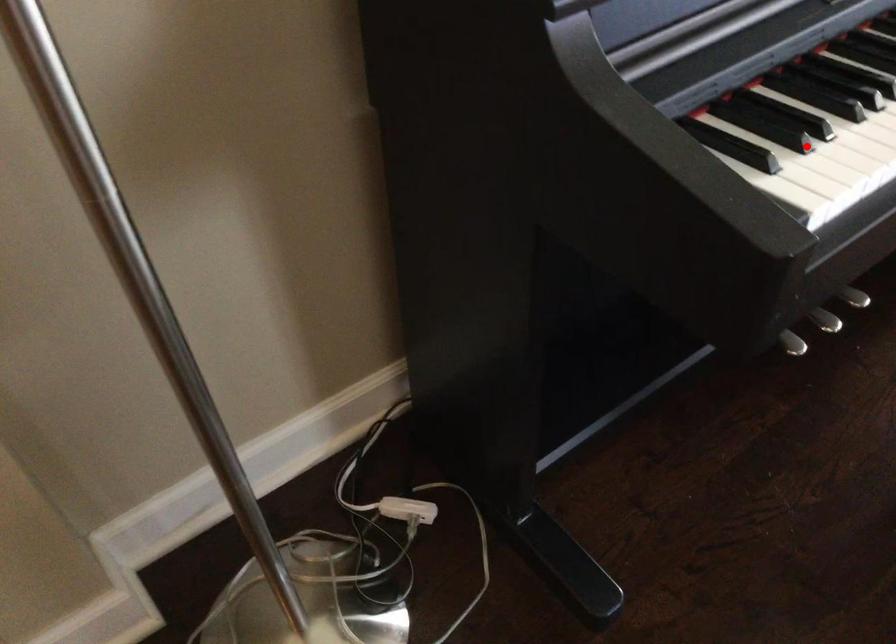
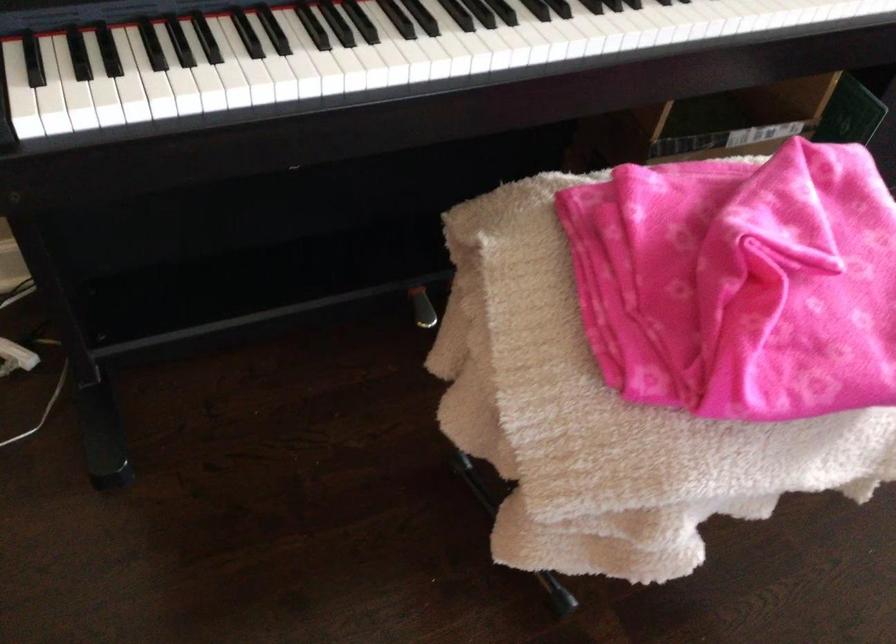
Question: I am providing you with two images of the same scene from different viewpoints. In image1, a red point is highlighted. Considering the same 3D point in image2, which of the following is correct?

Choices:
 (A) It is closer
 (B) It is farther

Answer: (B)